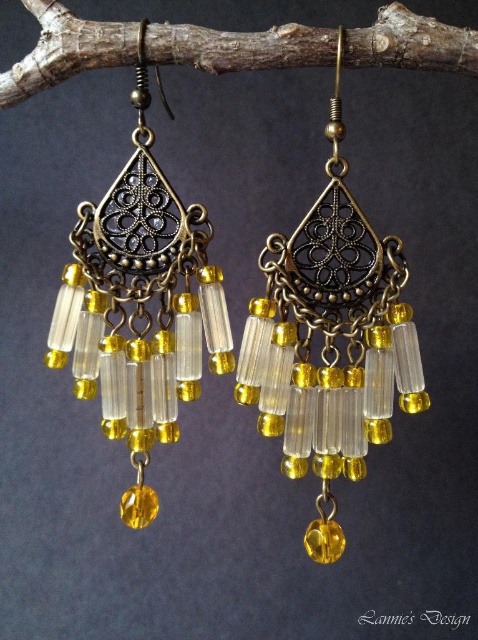
You are a jeweler examining these earrings from a distance of 1.2 meters. You notice a specific point labeled as point [122,234]. Can you reach this point with your hand without moving closer than your current position?

The distance between point [122,234] and the camera is 1.13 meters, which is less than your current distance of 1.2 meters. Therefore, you can reach the point without moving closer than your current position.

You are a jewelry designer examining two pairs of earrings displayed in the center of the image. The first pair is labeled as antique brass earrings at center, and the second pair is antique gold metal chandelier earrings at center. Which pair is located to the right?

The antique brass earrings at center is positioned on the right side of antique gold metal chandelier earrings at center, so the antique brass earrings at center is the pair located to the right.